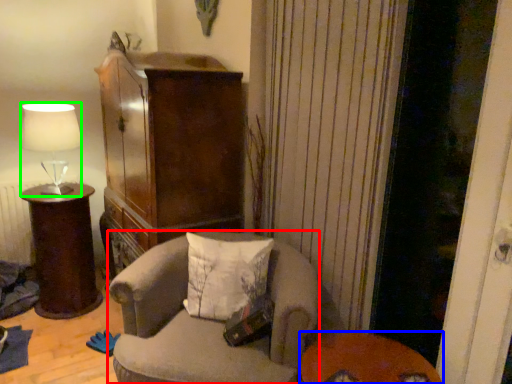
Question: Which object is the closest to the chair (highlighted by a red box)? Choose among these: table (highlighted by a blue box) or lamp (highlighted by a green box).

Choices:
 (A) table
 (B) lamp

Answer: (A)